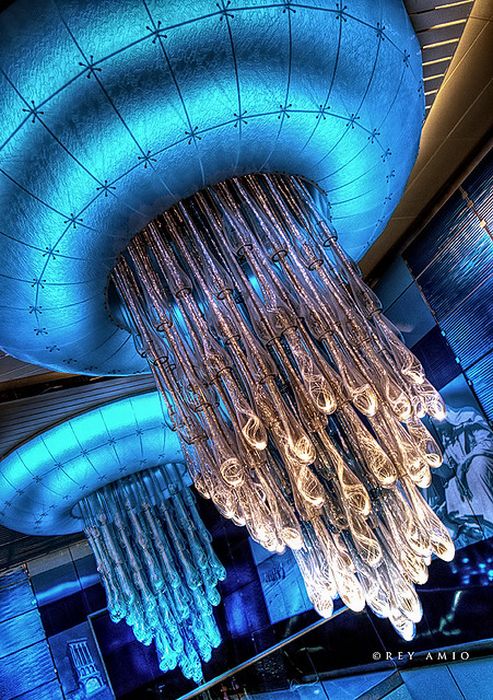
Locate an element on the screen. The width and height of the screenshot is (493, 700). glass panels is located at coordinates (55, 573), (90, 573), (16, 595), (26, 638), (31, 673), (353, 673), (293, 686), (439, 694), (463, 602).